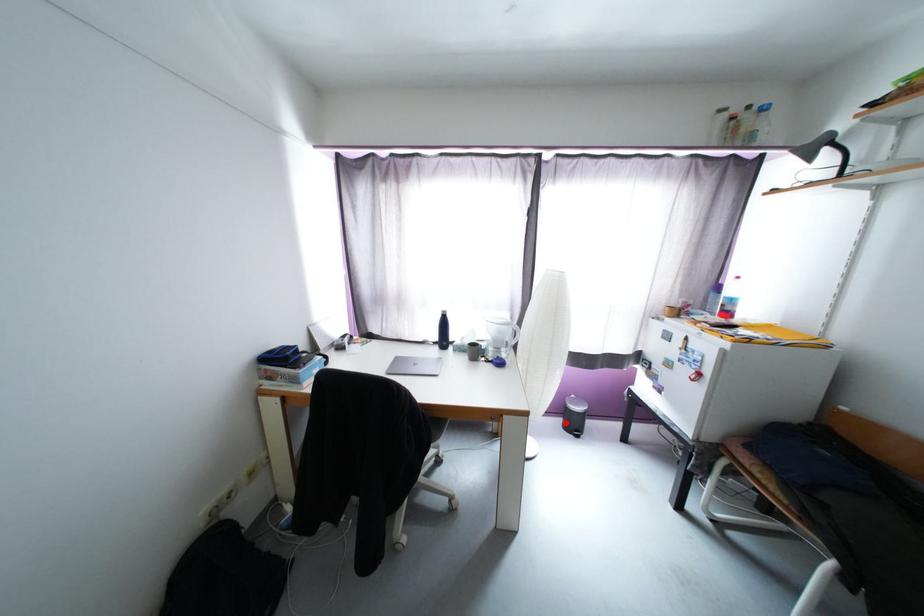
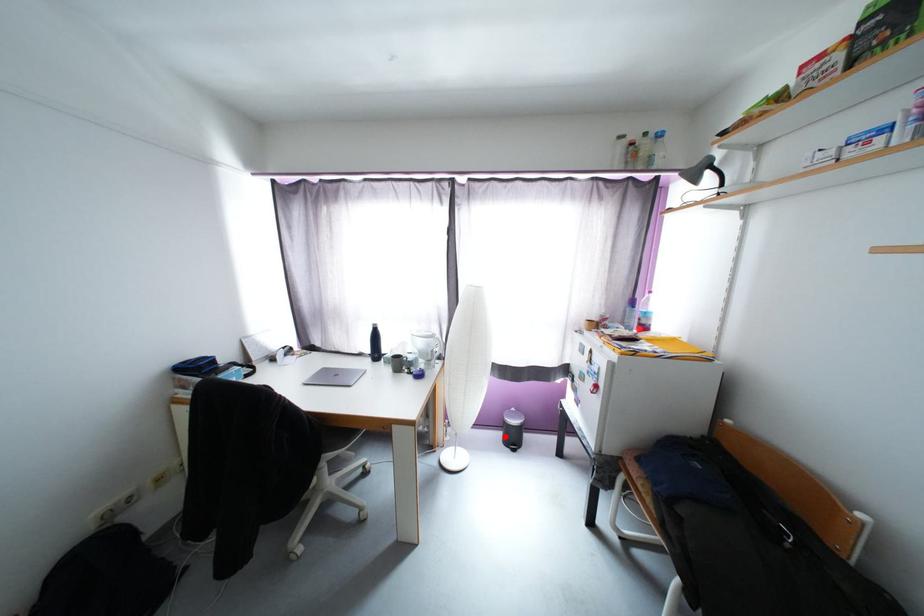
I am providing you with two images of the same scene from different viewpoints. A red point is marked on the first image and another point is marked on the second image. Is the marked point in image1 the same physical position as the marked point in image2?

Yes